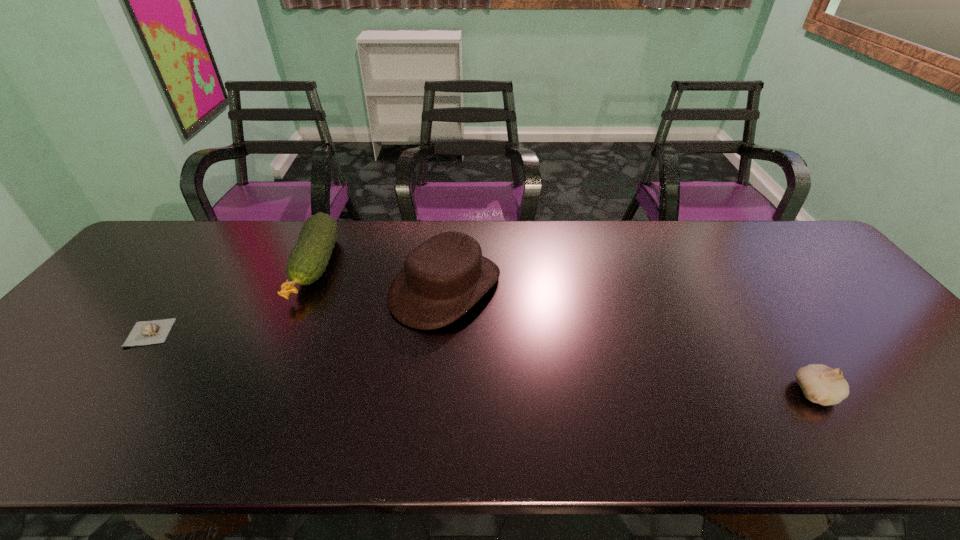
Image resolution: width=960 pixels, height=540 pixels. What are the coordinates of `hat` in the screenshot? It's located at (444, 277).

This screenshot has width=960, height=540. Identify the location of the tallest object. (444, 277).

The width and height of the screenshot is (960, 540). Identify the location of cucumber. (308, 260).

You are a GUI agent. You are given a task and a screenshot of the screen. Output one action in this format:
    pyautogui.click(x=<x>, y=<y>)
    Task: Click on the nearest object
    Image resolution: width=960 pixels, height=540 pixels.
    Given the screenshot: What is the action you would take?
    pyautogui.click(x=820, y=384)

This screenshot has height=540, width=960. I want to click on the nearer garlic, so click(820, 384).

Image resolution: width=960 pixels, height=540 pixels. I want to click on the left garlic, so click(150, 332).

The height and width of the screenshot is (540, 960). In order to click on the shorter garlic in this screenshot , I will do `click(150, 332)`.

Identify the location of vacant space located 0.070m on the back of the second object from right to left. (450, 238).

Identify the location of vacant space located at the blossom end of the cucumber. This screenshot has height=540, width=960. (x=259, y=392).

Locate an element on the screen. This screenshot has height=540, width=960. free region located on the right of the nearer garlic is located at coordinates (863, 393).